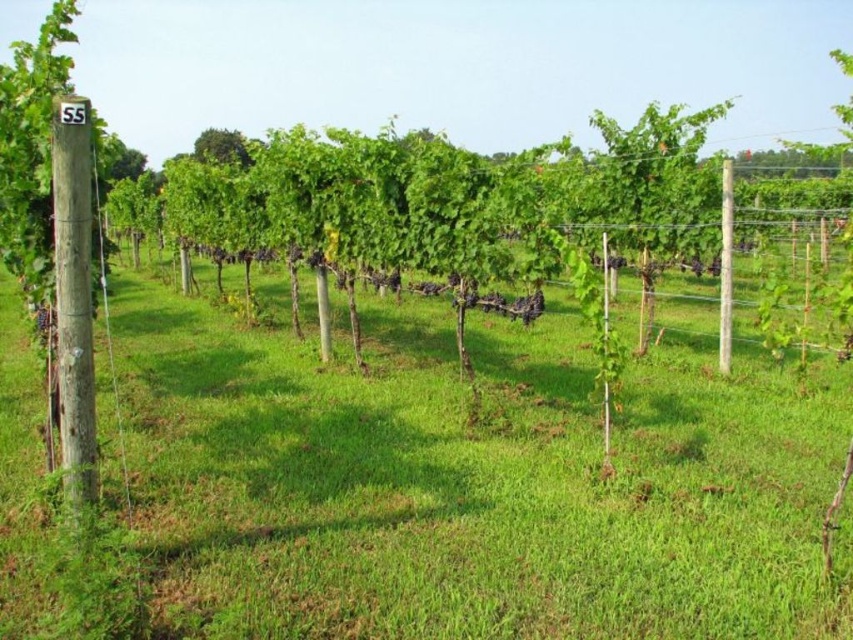
You are a gardener standing at the entrance of the vineyard. You see the green grass at center and the green leafy tree at upper center. Which object is closer to you?

The green grass at center is closer to you because it is in front of the green leafy tree at upper center.

You are a farmer inspecting the vineyard. You notice the green grass at center and the green leafy tree at upper center. Which of these two has a smaller size in the image?

The green grass at center has a smaller size compared to the green leafy tree at upper center.